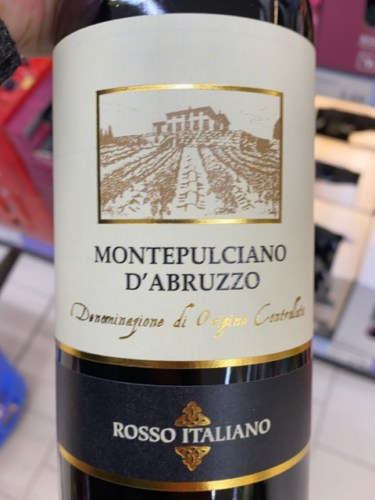
Locate an element on the screen. wine bottle is located at coordinates (262, 369).